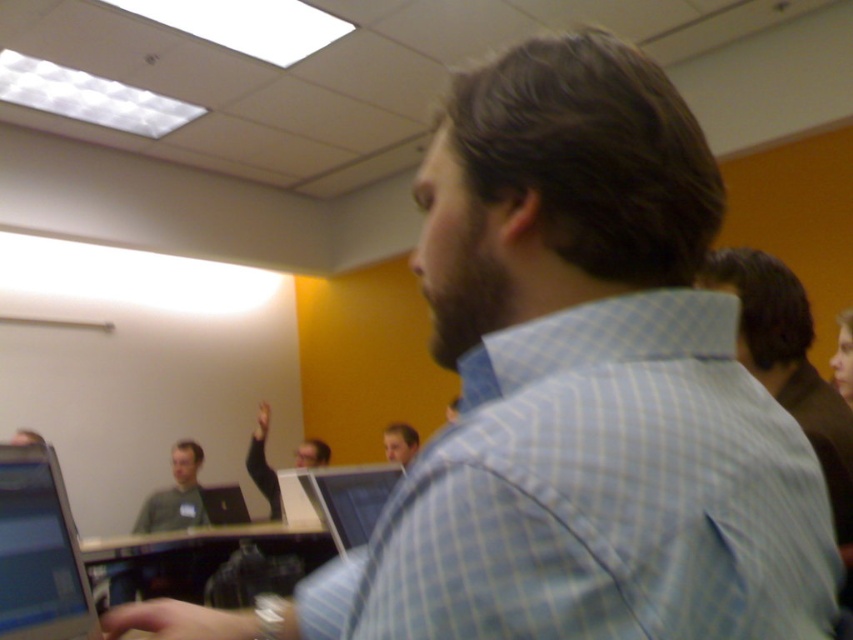
From the picture: Between smooth skin hand at lower left and smooth skin face at center, which one is positioned lower?

smooth skin face at center is lower down.

Locate an element on the screen. The width and height of the screenshot is (853, 640). smooth skin hand at lower left is located at coordinates [178, 620].

Who is more distant from viewer, (235, 504) or (410, 433)?

The point (410, 433) is more distant.

Between black glossy laptop at center and smooth skin face at center, which one appears on the left side from the viewer's perspective?

black glossy laptop at center is more to the left.

Which is in front, point (225, 504) or point (387, 444)?

Point (225, 504) is in front.

I want to click on black glossy laptop at center, so click(x=223, y=504).

Does gray sweater at lower left come behind black fabric sleeve at upper center?

Yes, gray sweater at lower left is further from the viewer.

Where is `gray sweater at lower left`? The height and width of the screenshot is (640, 853). gray sweater at lower left is located at coordinates (175, 493).